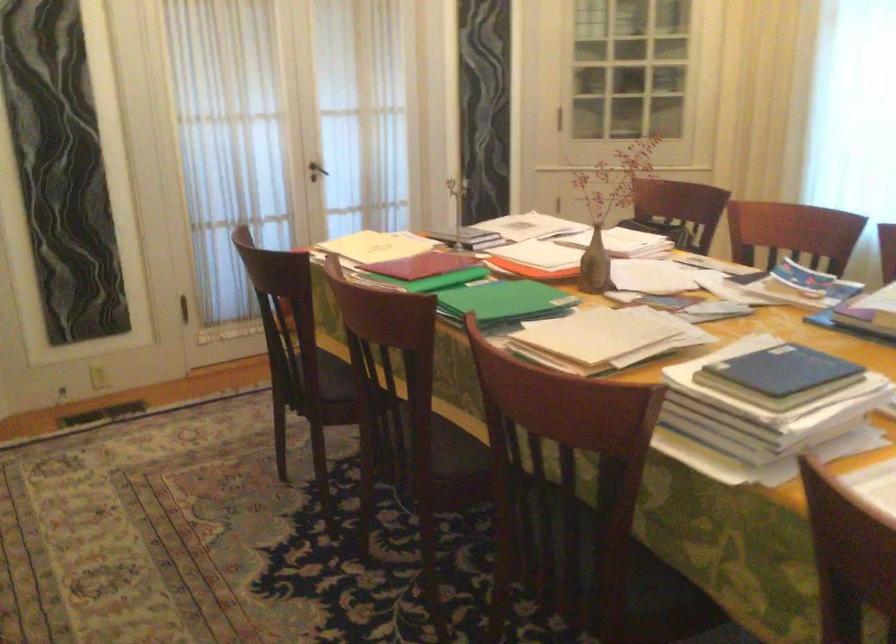
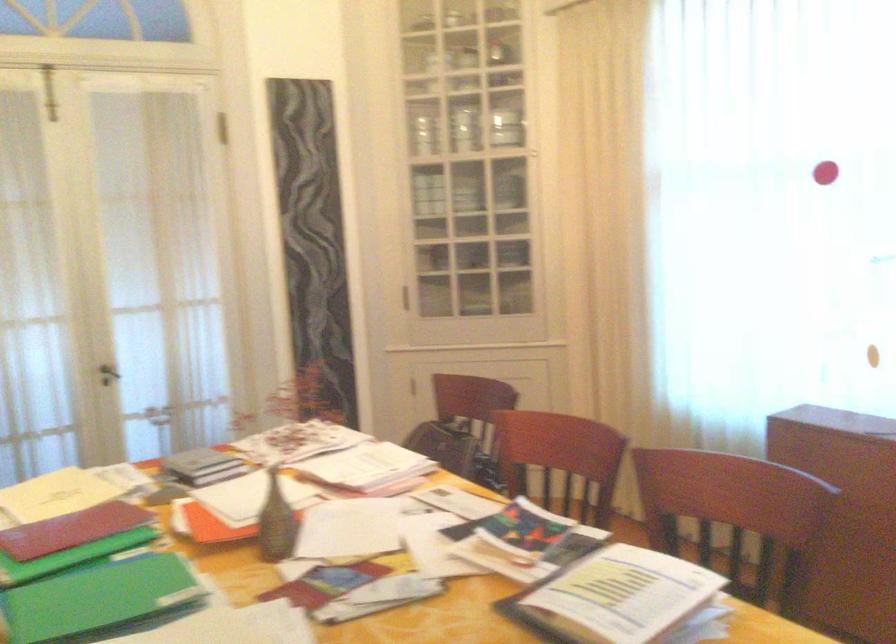
Question: The first image is from the beginning of the video and the second image is from the end. How did the camera likely rotate when shooting the video?

Choices:
 (A) Left
 (B) Right
 (C) Up
 (D) Down

Answer: (C)